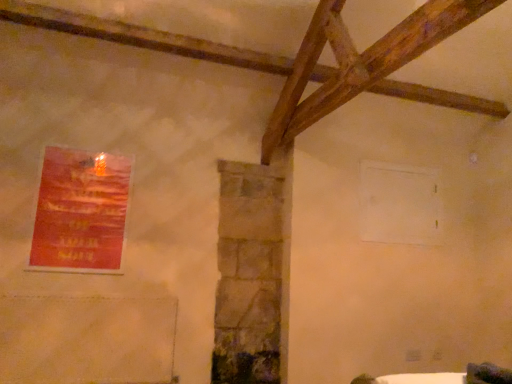
Question: Should I look upward or downward to see red paper poster at left?

Choices:
 (A) down
 (B) up

Answer: (A)